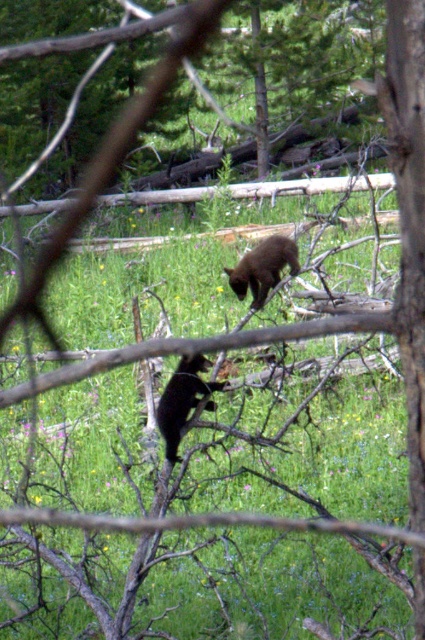
Which is above, black furry bear at center or shiny black bear at center?

Positioned higher is shiny black bear at center.

Between point (181, 365) and point (265, 269), which one is positioned behind?

The point (265, 269) is more distant.

Image resolution: width=425 pixels, height=640 pixels. I want to click on black furry bear at center, so click(183, 400).